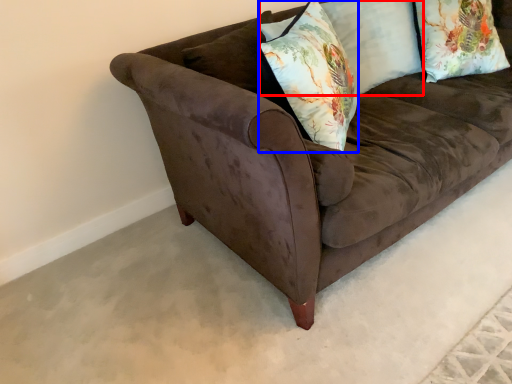
Question: Among these objects, which one is nearest to the camera, pillow (highlighted by a red box) or throw pillow (highlighted by a blue box)?

Choices:
 (A) pillow
 (B) throw pillow

Answer: (B)